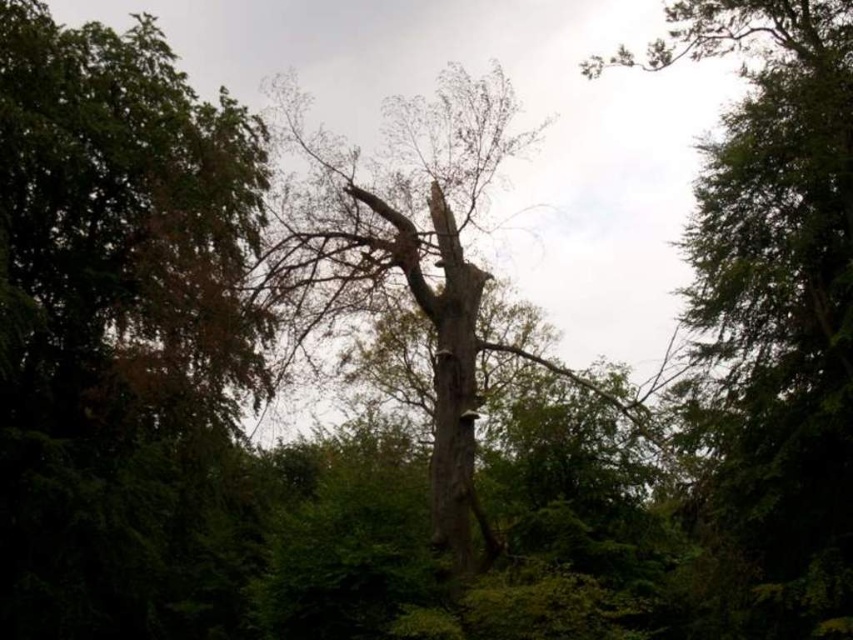
Question: Is green leafy tree at left bigger than grayish-brown bark tree trunk at center?

Choices:
 (A) yes
 (B) no

Answer: (A)

Question: Which of these objects is positioned farthest from the grayish-brown bark tree trunk at center?

Choices:
 (A) green leafy tree at upper center
 (B) green leafy tree at left
 (C) smooth bark tree at center

Answer: (B)

Question: Considering the real-world distances, which object is farthest from the green leafy tree at left?

Choices:
 (A) grayish-brown bark tree trunk at center
 (B) smooth bark tree at center

Answer: (B)

Question: Which is nearer to the green leafy tree at upper center?

Choices:
 (A) smooth bark tree at center
 (B) grayish-brown bark tree trunk at center

Answer: (B)

Question: Can you confirm if green leafy tree at upper center is bigger than grayish-brown bark tree trunk at center?

Choices:
 (A) no
 (B) yes

Answer: (B)

Question: Does green leafy tree at left appear on the right side of grayish-brown bark tree trunk at center?

Choices:
 (A) no
 (B) yes

Answer: (A)